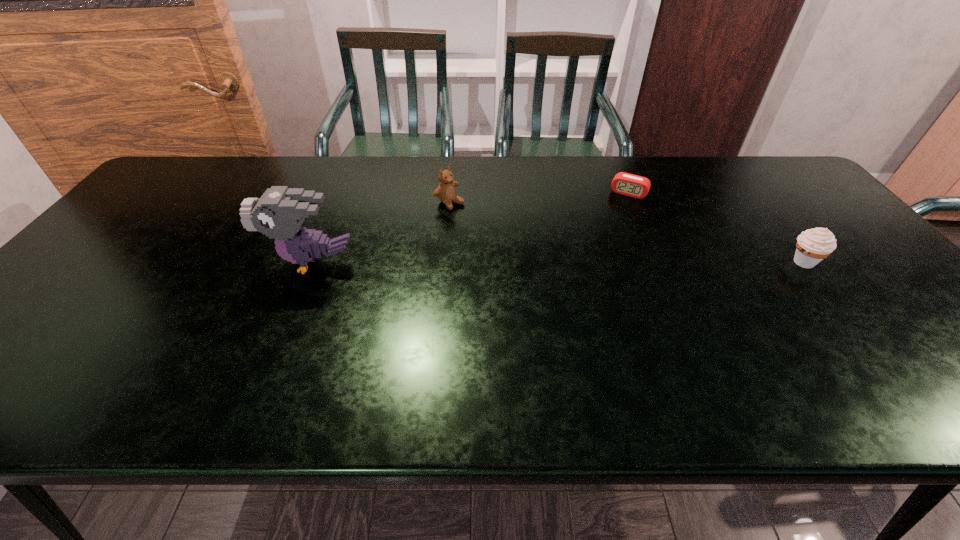
At what (x,y) coordinates should I click in order to perform the action: click on vacant area located 0.050m on the front-facing side of the shortest object. Please return your answer as a coordinate pair (x, y). Looking at the image, I should click on (619, 208).

The width and height of the screenshot is (960, 540). I want to click on free point located 0.370m on the front-facing side of the shortest object, so click(x=587, y=275).

What are the coordinates of `free point located on the front-facing side of the shortest object` in the screenshot? It's located at (606, 237).

I want to click on vacant space located on the front-facing side of the teddy bear, so click(x=486, y=228).

Find the location of a particular element. vacant area situated 0.130m on the front-facing side of the teddy bear is located at coordinates (489, 230).

Find the location of a particular element. The width and height of the screenshot is (960, 540). free location located on the front-facing side of the teddy bear is located at coordinates (477, 221).

Identify the location of alarm clock positioned at the far edge. (623, 183).

The width and height of the screenshot is (960, 540). I want to click on teddy bear located in the far edge section of the desktop, so click(x=446, y=192).

Identify the location of object present at the right edge. The image size is (960, 540). [813, 245].

The image size is (960, 540). I want to click on free space at the far edge, so click(x=672, y=179).